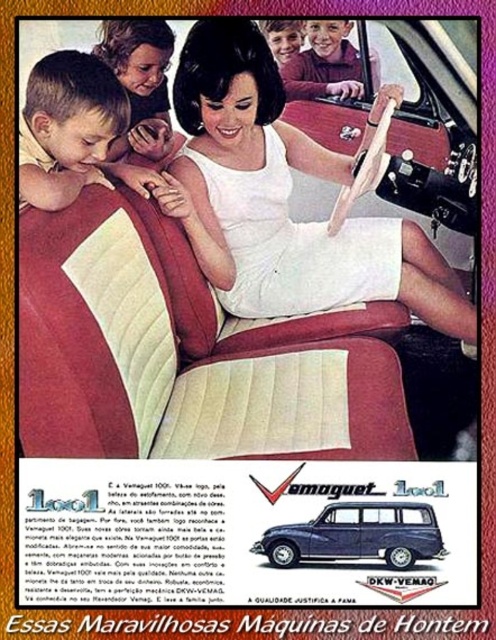
Between blue metallic station wagon at center and light brown hair at upper center, which one has more height?

With more height is light brown hair at upper center.

Measure the distance between blue metallic station wagon at center and light brown hair at upper center.

They are 5.98 feet apart.

Image resolution: width=496 pixels, height=640 pixels. What do you see at coordinates (357, 534) in the screenshot?
I see `blue metallic station wagon at center` at bounding box center [357, 534].

Find the location of a particular element. blue metallic station wagon at center is located at coordinates (357, 534).

Consider the image. Does light brown hair at left have a lesser height compared to light brown hair at upper left?

Yes.

Does light brown hair at left have a greater height compared to light brown hair at upper left?

Incorrect, light brown hair at left's height is not larger of light brown hair at upper left's.

This screenshot has width=496, height=640. What do you see at coordinates (67, 128) in the screenshot? I see `light brown hair at left` at bounding box center [67, 128].

You are a GUI agent. You are given a task and a screenshot of the screen. Output one action in this format:
    pyautogui.click(x=<x>, y=<y>)
    Task: Click on the light brown hair at left
    The height and width of the screenshot is (640, 496).
    Given the screenshot: What is the action you would take?
    pyautogui.click(x=67, y=128)

Is light brown hair at left below light brown hair at upper center?

Indeed, light brown hair at left is positioned under light brown hair at upper center.

Is light brown hair at left taller than light brown hair at upper center?

Indeed, light brown hair at left has a greater height compared to light brown hair at upper center.

Measure the distance between light brown hair at left and camera.

They are 4.34 feet apart.

Where is `light brown hair at left`? light brown hair at left is located at coordinates (67, 128).